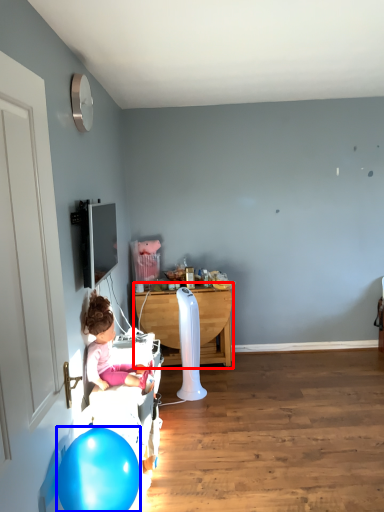
Question: Among these objects, which one is nearest to the camera, table (highlighted by a red box) or balloon (highlighted by a blue box)?

Choices:
 (A) table
 (B) balloon

Answer: (B)